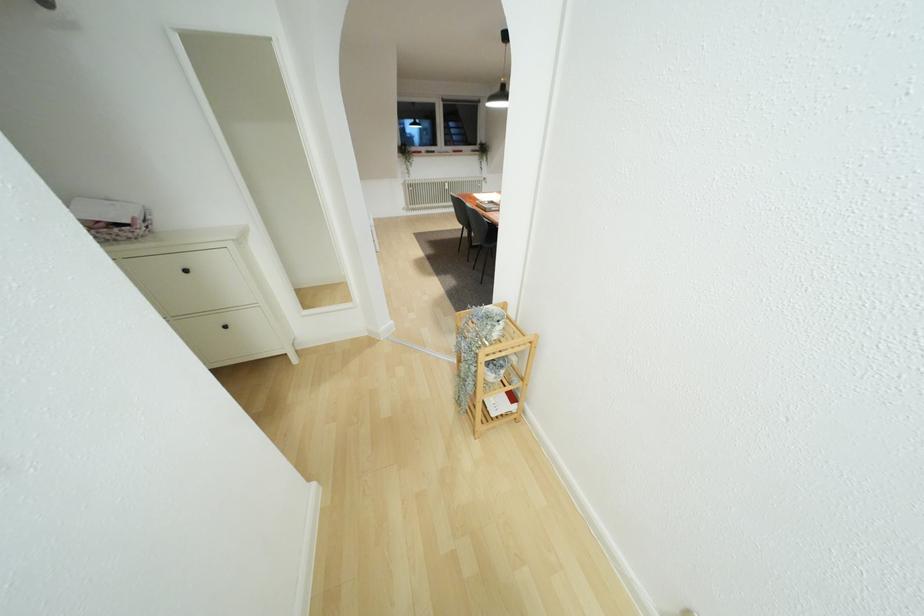
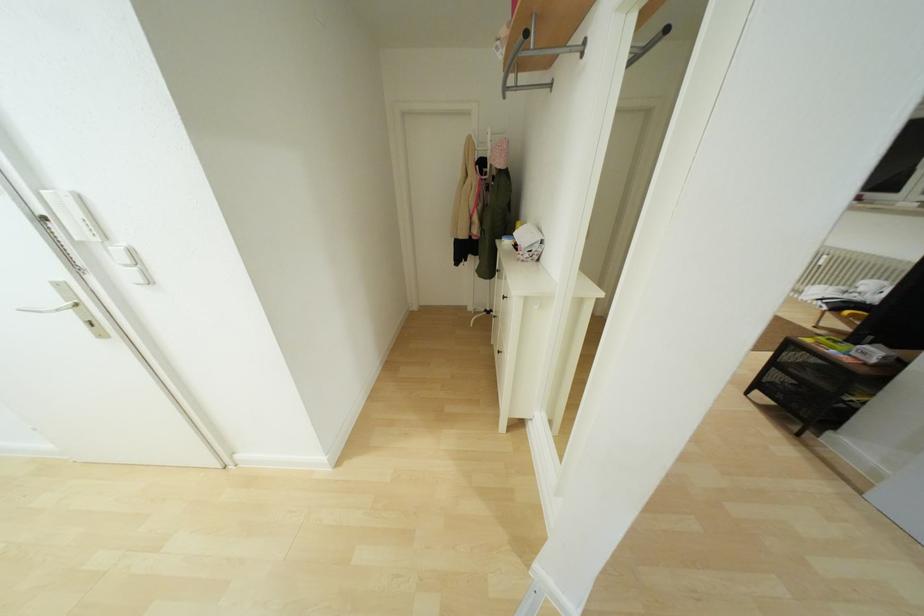
The point at (225, 326) is marked in the first image. Where is the corresponding point in the second image?

(497, 352)